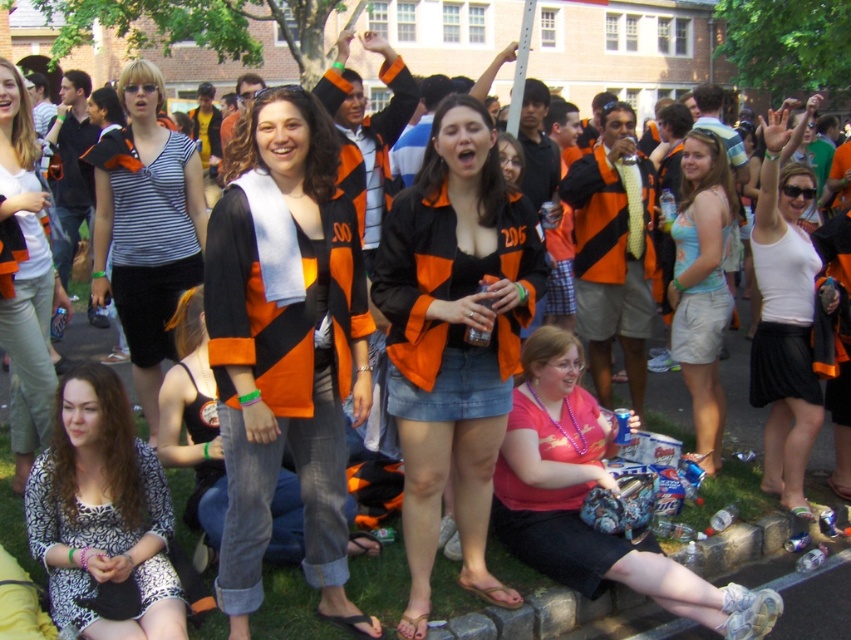
Does orange and black striped jacket at center appear under white matte tank top at upper right?

Yes, orange and black striped jacket at center is below white matte tank top at upper right.

At what (x,y) coordinates should I click in order to perform the action: click on orange and black striped jacket at center. Please return your answer as a coordinate pair (x, y). This screenshot has width=851, height=640. Looking at the image, I should click on (454, 339).

You are a GUI agent. You are given a task and a screenshot of the screen. Output one action in this format:
    pyautogui.click(x=<x>, y=<y>)
    Task: Click on the orange and black striped jacket at center
    The height and width of the screenshot is (640, 851).
    Given the screenshot: What is the action you would take?
    pyautogui.click(x=454, y=339)

Does point (724, 596) come in front of point (684, 291)?

Yes, it is in front of point (684, 291).

Looking at this image, which is more to the left, pink matte shirt at lower center or light blue denim shorts at center?

Positioned to the left is pink matte shirt at lower center.

Does point (575, 419) come in front of point (707, 145)?

Yes.

Locate an element on the screen. The width and height of the screenshot is (851, 640). pink matte shirt at lower center is located at coordinates (584, 497).

Who is positioned more to the left, orange matte jacket at center or pink matte shirt at lower center?

From the viewer's perspective, orange matte jacket at center appears more on the left side.

Who is more forward, (335,573) or (547,497)?

Positioned in front is point (335,573).

The height and width of the screenshot is (640, 851). I want to click on orange matte jacket at center, so click(x=286, y=352).

Identify the location of orange matte jacket at center. (286, 352).